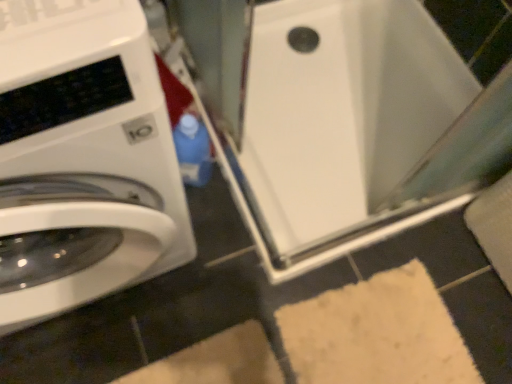
Question: From the image's perspective, is white glossy washing machine at left above or below white glossy water heater at center?

Choices:
 (A) above
 (B) below

Answer: (B)

Question: Considering the positions of point pyautogui.click(x=81, y=177) and point pyautogui.click(x=345, y=249), is point pyautogui.click(x=81, y=177) closer or farther from the camera than point pyautogui.click(x=345, y=249)?

Choices:
 (A) closer
 (B) farther

Answer: (A)

Question: Considering the positions of white glossy washing machine at left and white glossy water heater at center in the image, is white glossy washing machine at left bigger or smaller than white glossy water heater at center?

Choices:
 (A) small
 (B) big

Answer: (B)

Question: Is white glossy water heater at center inside or outside of white glossy washing machine at left?

Choices:
 (A) outside
 (B) inside

Answer: (A)

Question: From the image's perspective, is white glossy water heater at center above or below white glossy washing machine at left?

Choices:
 (A) above
 (B) below

Answer: (A)

Question: In the image, is white glossy water heater at center positioned in front of or behind white glossy washing machine at left?

Choices:
 (A) front
 (B) behind

Answer: (B)

Question: Is white glossy water heater at center to the left or to the right of white glossy washing machine at left in the image?

Choices:
 (A) right
 (B) left

Answer: (A)